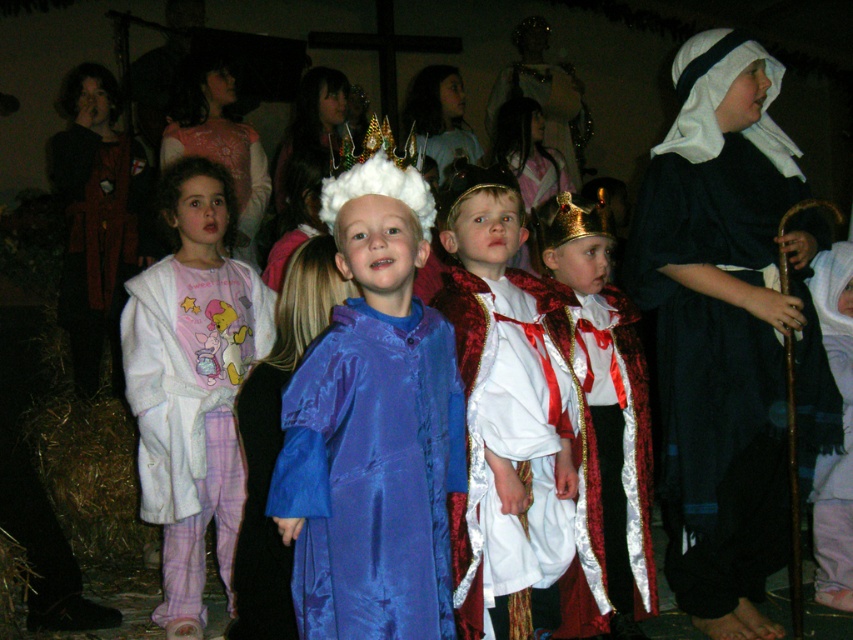
You are a photographer standing behind the children. You need to capture a photo that includes both the satin blue robe at center and the white fleece robe at left. The camera has a maximum focus range of 1.2 meters. Can you take a photo that includes both without moving the children?

The distance between the satin blue robe at center and the white fleece robe at left is 1.33 meters. Since the camera can only focus within 1.2 meters, the photographer cannot capture both in focus without moving the children.

You are a photographer trying to capture a clear photo of the gold glittering crown at center and the gold metallic crown at center. Which crown will appear smaller in the photo?

The gold glittering crown at center will appear smaller in the photo because it is positioned behind the gold metallic crown at center, making it farther from the camera.

You are a photographer trying to capture a clear photo of both the gold metallic crown at center and the gold glittering crown at center. Since they are both at the center, which one should you focus on first to ensure both are in frame?

The gold metallic crown at center is to the right of the gold glittering crown at center, so focus on the gold glittering crown at center first to ensure both are in frame.